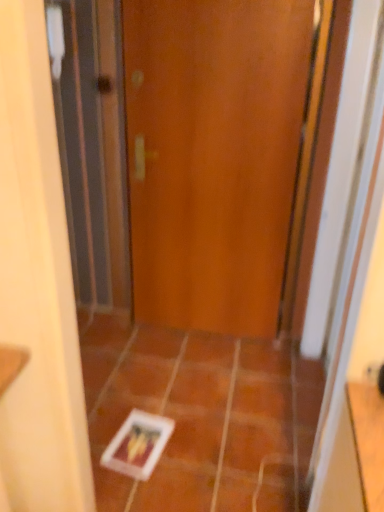
Question: Considering the positions of orange matte tile at center, which ranks as the first ceramic tile in right-to-left order, and white glossy tile at center, arranged as the 1th ceramic tile when viewed from the left, in the image, is orange matte tile at center, which ranks as the first ceramic tile in right-to-left order, wider or thinner than white glossy tile at center, arranged as the 1th ceramic tile when viewed from the left,?

Choices:
 (A) thin
 (B) wide

Answer: (A)

Question: From their relative heights in the image, would you say orange matte tile at center, the 2th ceramic tile positioned from the left, is taller or shorter than white glossy tile at center, which is the second ceramic tile in right-to-left order?

Choices:
 (A) short
 (B) tall

Answer: (A)

Question: Which of these objects is positioned farthest from the white glossy tile at center, arranged as the 1th ceramic tile when viewed from the left?

Choices:
 (A) orange matte tile at center, which ranks as the first ceramic tile in right-to-left order
 (B) wooden door at center

Answer: (B)

Question: Which of these objects is positioned closest to the white glossy tile at center, which is the second ceramic tile in right-to-left order?

Choices:
 (A) orange matte tile at center, the 2th ceramic tile positioned from the left
 (B) wooden door at center

Answer: (A)